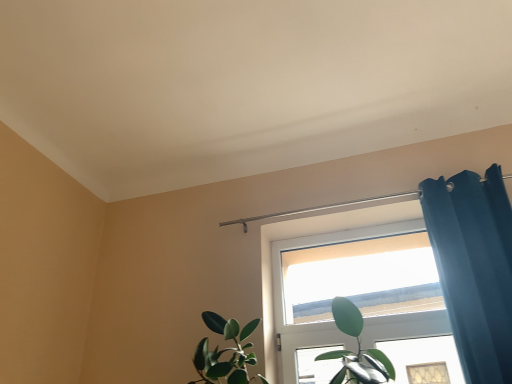
Question: From a real-world perspective, relative to teal velvet curtain at right, is white matte window at upper center vertically above or below?

Choices:
 (A) below
 (B) above

Answer: (B)

Question: Considering the positions of white matte window at upper center and teal velvet curtain at right in the image, is white matte window at upper center bigger or smaller than teal velvet curtain at right?

Choices:
 (A) big
 (B) small

Answer: (B)

Question: Relative to teal velvet curtain at right, is white matte window at upper center in front or behind?

Choices:
 (A) behind
 (B) front

Answer: (A)

Question: Is teal velvet curtain at right in front of or behind white matte window at upper center in the image?

Choices:
 (A) behind
 (B) front

Answer: (B)

Question: Looking at their shapes, would you say teal velvet curtain at right is wider or thinner than white matte window at upper center?

Choices:
 (A) wide
 (B) thin

Answer: (A)

Question: In terms of size, does teal velvet curtain at right appear bigger or smaller than white matte window at upper center?

Choices:
 (A) big
 (B) small

Answer: (A)

Question: Is point (509, 258) closer or farther from the camera than point (379, 309)?

Choices:
 (A) closer
 (B) farther

Answer: (A)